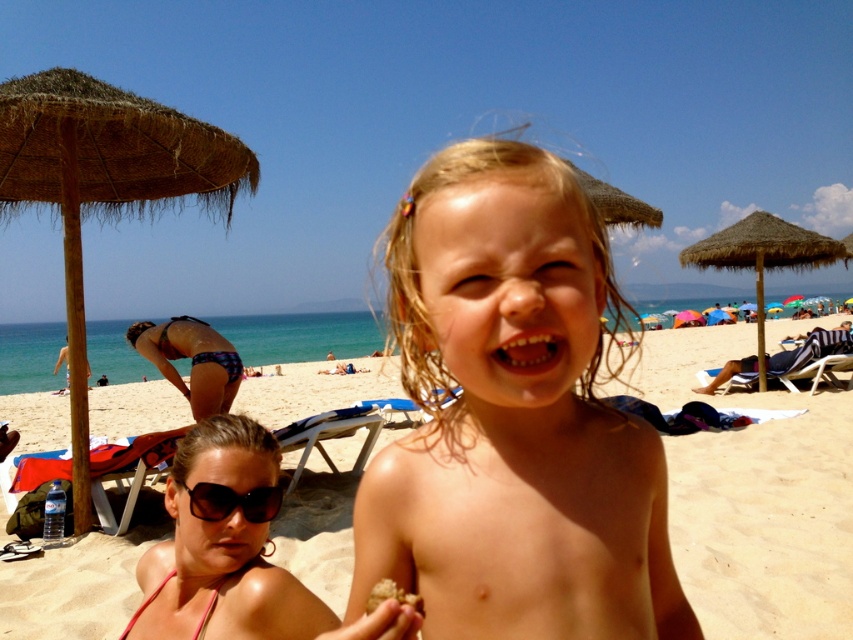
Who is lower down, plaid bikini bottom at lower left or brown crumbly food at center?

plaid bikini bottom at lower left is lower down.

Based on the photo, is plaid bikini bottom at lower left bigger than brown crumbly food at center?

Indeed, plaid bikini bottom at lower left has a larger size compared to brown crumbly food at center.

At what (x,y) coordinates should I click in order to perform the action: click on plaid bikini bottom at lower left. Please return your answer as a coordinate pair (x, y). The width and height of the screenshot is (853, 640). Looking at the image, I should click on (190, 360).

Is beige sand at center to the left of thatched straw umbrella at upper right from the viewer's perspective?

Correct, you'll find beige sand at center to the left of thatched straw umbrella at upper right.

Does beige sand at center have a larger size compared to thatched straw umbrella at upper right?

Yes.

Locate an element on the screen. beige sand at center is located at coordinates [756, 497].

From the picture: Is beige sand at center smaller than brown straw umbrella at upper left?

No, beige sand at center is not smaller than brown straw umbrella at upper left.

Is point (741, 515) positioned after point (86, 509)?

Yes, point (741, 515) is farther from viewer.

Is point (318, 468) positioned behind point (119, 115)?

That is True.

Locate an element on the screen. Image resolution: width=853 pixels, height=640 pixels. beige sand at center is located at coordinates (756, 497).